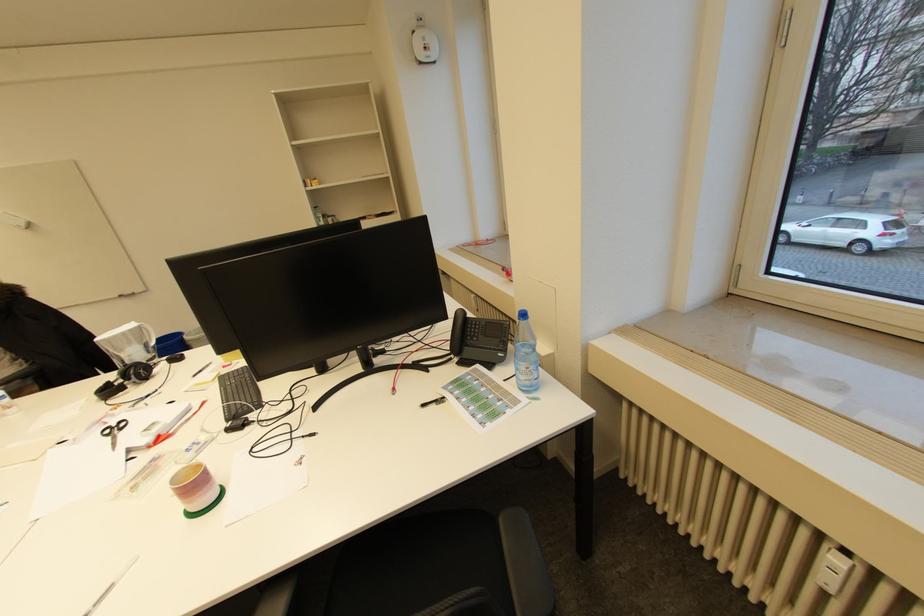
What do you see at coordinates (523, 317) in the screenshot?
I see `the blue bottle cap` at bounding box center [523, 317].